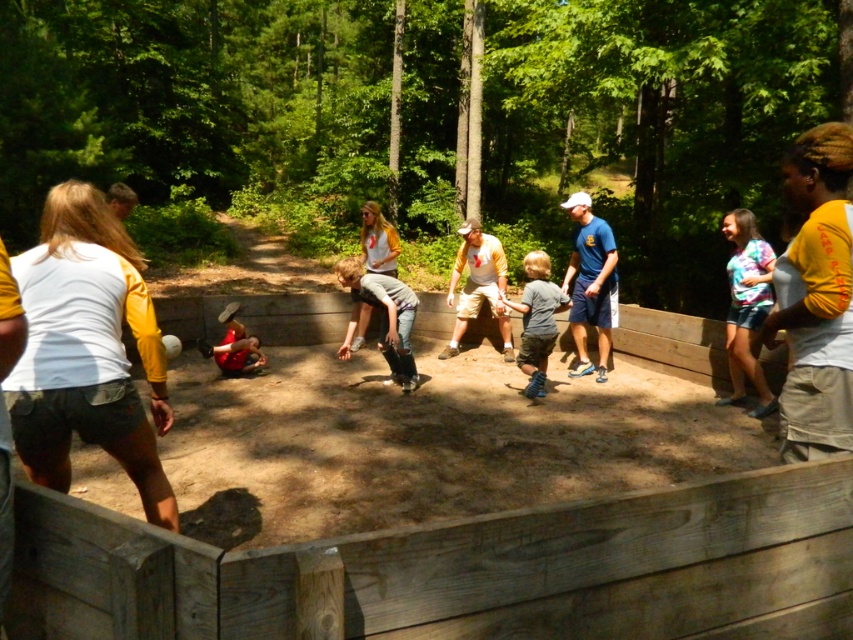
You are standing at the origin point of the image. Which direction should you move to reach the wooden fence at center?

The wooden fence at center is located at point 0.891 on the x axis and 0.533 on the y axis. Since you are at the origin point, you should move towards the right along the x axis and slightly upwards along the y axis to reach it.

You are standing at the sandbox and want to place a small toy between the two points, point (352, 257) and point (231, 332). Which point is closer to you so the toy can be placed near it?

Point (231, 332) is closer to you than point (352, 257), so placing the toy near point (231, 332) would be closer.